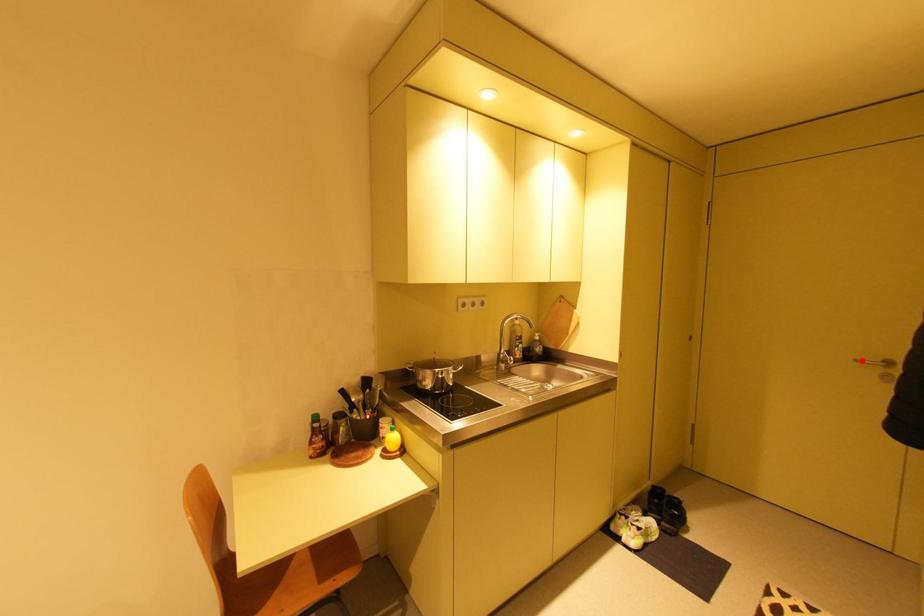
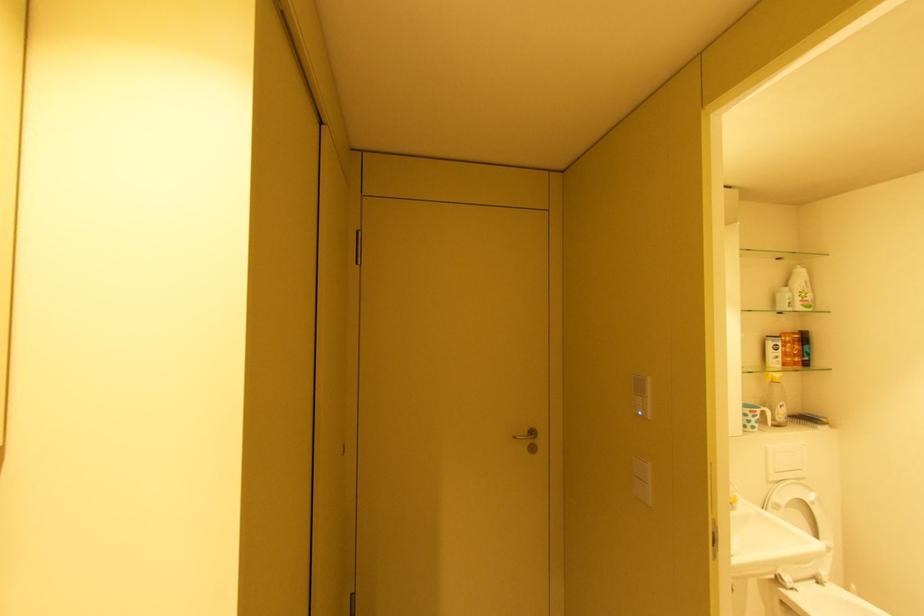
Question: I am providing you with two images of the same scene from different viewpoints. In image1, a red point is highlighted. Considering the same 3D point in image2, which of the following is correct?

Choices:
 (A) It is closer
 (B) It is farther

Answer: (A)